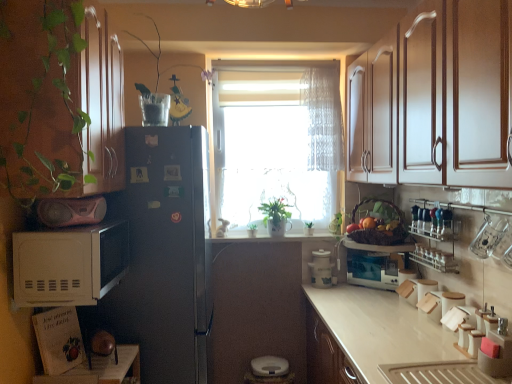
Describe the element at coordinates (321, 269) in the screenshot. The image size is (512, 384). I see `white plastic container at center, positioned as the 1th appliance in back-to-front order` at that location.

Where is `white plastic container at center, the third appliance positioned from the bottom`? This screenshot has height=384, width=512. white plastic container at center, the third appliance positioned from the bottom is located at coordinates (321, 269).

The image size is (512, 384). What do you see at coordinates (323, 118) in the screenshot?
I see `translucent fabric curtain at center` at bounding box center [323, 118].

Describe the element at coordinates (497, 355) in the screenshot. I see `white plastic soap dispenser at lower right, marked as the 1th appliance in a front-to-back arrangement` at that location.

At what (x,y) coordinates should I click in order to perform the action: click on white plastic soap dispenser at lower right, marked as the 1th appliance in a front-to-back arrangement. Please return your answer as a coordinate pair (x, y). This screenshot has width=512, height=384. Looking at the image, I should click on (497, 355).

What is the approximate height of green matte plant at center?

green matte plant at center is 9.45 inches in height.

At what (x,y) coordinates should I click in order to perform the action: click on white plastic container at center, which is the 2th appliance from left to right. Please return your answer as a coordinate pair (x, y). The height and width of the screenshot is (384, 512). Looking at the image, I should click on (321, 269).

How much distance is there between white glossy cabinet at upper right, which ranks as the 2th cabinetry in left-to-right order, and green matte cabinet at left, which appears as the second cabinetry when viewed from the right?

1.26 meters.

From the picture: Between white glossy cabinet at upper right, which ranks as the 2th cabinetry in left-to-right order, and green matte cabinet at left, which appears as the second cabinetry when viewed from the right, which one is positioned behind?

green matte cabinet at left, which appears as the second cabinetry when viewed from the right.

Find the location of a particular element. The image size is (512, 384). cabinetry below the white glossy cabinet at upper right, positioned as the first cabinetry in right-to-left order (from the image's perspective) is located at coordinates (60, 101).

Considering the relative sizes of white glossy cabinet at upper right, positioned as the first cabinetry in right-to-left order, and green matte cabinet at left, acting as the 1th cabinetry starting from the left, in the image provided, is white glossy cabinet at upper right, positioned as the first cabinetry in right-to-left order, wider than green matte cabinet at left, acting as the 1th cabinetry starting from the left,?

Correct, the width of white glossy cabinet at upper right, positioned as the first cabinetry in right-to-left order, exceeds that of green matte cabinet at left, acting as the 1th cabinetry starting from the left.

Can you confirm if translucent fabric curtain at center is wider than green matte cabinet at left, which appears as the second cabinetry when viewed from the right?

No.

From a real-world perspective, between translucent fabric curtain at center and green matte cabinet at left, acting as the 1th cabinetry starting from the left, who is vertically higher?

translucent fabric curtain at center, from a real-world perspective.

Who is bigger, translucent fabric curtain at center or green matte cabinet at left, acting as the 1th cabinetry starting from the left?

Bigger between the two is green matte cabinet at left, acting as the 1th cabinetry starting from the left.

Can white plastic soap dispenser at lower right, acting as the fourth appliance starting from the left, be found inside green matte cabinet at left, acting as the 1th cabinetry starting from the left?

Actually, white plastic soap dispenser at lower right, acting as the fourth appliance starting from the left, is outside green matte cabinet at left, acting as the 1th cabinetry starting from the left.

From the image's perspective, which is above, green matte cabinet at left, which appears as the second cabinetry when viewed from the right, or white plastic soap dispenser at lower right, the first appliance when ordered from bottom to top?

green matte cabinet at left, which appears as the second cabinetry when viewed from the right, from the image's perspective.

Which is in front, point (112, 61) or point (498, 361)?

The point (498, 361) is closer.

Is green matte cabinet at left, which appears as the second cabinetry when viewed from the right, far away from white plastic soap dispenser at lower right, placed as the fourth appliance when sorted from back to front?

Yes, green matte cabinet at left, which appears as the second cabinetry when viewed from the right, is far from white plastic soap dispenser at lower right, placed as the fourth appliance when sorted from back to front.

Is point (267, 227) behind point (478, 361)?

Yes, it is.

Does green matte plant at center have a lesser height compared to white plastic soap dispenser at lower right, marked as the first appliance in a right-to-left arrangement?

No, green matte plant at center is not shorter than white plastic soap dispenser at lower right, marked as the first appliance in a right-to-left arrangement.

From the picture: From a real-world perspective, which is physically above, green matte plant at center or white plastic soap dispenser at lower right, placed as the fourth appliance when sorted from back to front?

green matte plant at center, from a real-world perspective.

From the image's perspective, between green matte plant at center and white plastic soap dispenser at lower right, marked as the first appliance in a right-to-left arrangement, which one is located above?

green matte plant at center appears higher in the image.

In the scene shown: How far apart are white plastic soap dispenser at lower right, the first appliance when ordered from bottom to top, and clear glass bottles at upper right?

white plastic soap dispenser at lower right, the first appliance when ordered from bottom to top, and clear glass bottles at upper right are 25.71 inches apart from each other.

Does white plastic soap dispenser at lower right, marked as the first appliance in a right-to-left arrangement, lie behind clear glass bottles at upper right?

No, the depth of white plastic soap dispenser at lower right, marked as the first appliance in a right-to-left arrangement, is less than that of clear glass bottles at upper right.

In the image, is white plastic soap dispenser at lower right, marked as the first appliance in a right-to-left arrangement, on the left side or the right side of clear glass bottles at upper right?

Clearly, white plastic soap dispenser at lower right, marked as the first appliance in a right-to-left arrangement, is on the left of clear glass bottles at upper right in the image.

Considering the points (487, 358) and (460, 226), which point is behind, point (487, 358) or point (460, 226)?

Point (460, 226)

From the image's perspective, would you say pink matte boombox at left, which is the third appliance from back to front, is shown under orange matte at right?

Actually, pink matte boombox at left, which is the third appliance from back to front, appears above orange matte at right in the image.

Does pink matte boombox at left, which ranks as the 4th appliance in right-to-left order, come behind orange matte at right?

No, it is in front of orange matte at right.

Between point (95, 206) and point (374, 220), which one is positioned in front?

Positioned in front is point (95, 206).

Would you consider pink matte boombox at left, which is the third appliance from back to front, to be distant from orange matte at right?

Yes, pink matte boombox at left, which is the third appliance from back to front, and orange matte at right are located far from each other.

Does white plastic soap dispenser at lower right, marked as the first appliance in a right-to-left arrangement, have a lesser height compared to white glossy cabinet at upper right, which ranks as the 2th cabinetry in left-to-right order?

Indeed, white plastic soap dispenser at lower right, marked as the first appliance in a right-to-left arrangement, has a lesser height compared to white glossy cabinet at upper right, which ranks as the 2th cabinetry in left-to-right order.

Is white plastic soap dispenser at lower right, placed as the fourth appliance when sorted from back to front, touching white glossy cabinet at upper right, which ranks as the 2th cabinetry in left-to-right order?

No, white plastic soap dispenser at lower right, placed as the fourth appliance when sorted from back to front, is not in contact with white glossy cabinet at upper right, which ranks as the 2th cabinetry in left-to-right order.

Considering the relative positions of white plastic soap dispenser at lower right, placed as the fourth appliance when sorted from back to front, and white glossy cabinet at upper right, positioned as the first cabinetry in right-to-left order, in the image provided, is white plastic soap dispenser at lower right, placed as the fourth appliance when sorted from back to front, to the right of white glossy cabinet at upper right, positioned as the first cabinetry in right-to-left order, from the viewer's perspective?

Indeed, white plastic soap dispenser at lower right, placed as the fourth appliance when sorted from back to front, is positioned on the right side of white glossy cabinet at upper right, positioned as the first cabinetry in right-to-left order.

You are a GUI agent. You are given a task and a screenshot of the screen. Output one action in this format:
    pyautogui.click(x=<x>, y=<y>)
    Task: Click on the cabinetry lying below the white glossy cabinet at upper right, positioned as the first cabinetry in right-to-left order (from the image's perspective)
    The image size is (512, 384).
    Given the screenshot: What is the action you would take?
    pyautogui.click(x=60, y=101)

The image size is (512, 384). What are the coordinates of `curtain above the green matte cabinet at left, which appears as the second cabinetry when viewed from the right (from the image's perspective)` in the screenshot? It's located at (323, 118).

Considering their positions, is translucent fabric curtain at center positioned further to white glossy countertop at lower right than green matte cabinet at left, acting as the 1th cabinetry starting from the left?

Based on the image, green matte cabinet at left, acting as the 1th cabinetry starting from the left, appears to be further to white glossy countertop at lower right.

Based on the photo, based on their spatial positions, is clear glass vase at upper center or white glossy countertop at lower right further from white plastic soap dispenser at lower right, the 4th appliance positioned from the top?

clear glass vase at upper center lies further to white plastic soap dispenser at lower right, the 4th appliance positioned from the top, than the other object.

When comparing their distances from orange matte at right, does translucent fabric curtain at center or pink matte boombox at left, acting as the 1th appliance starting from the left, seem closer?

translucent fabric curtain at center is closer to orange matte at right.

Based on their spatial positions, is orange matte at right or white matte microwave at left further from green matte plant at center?

white matte microwave at left is positioned further to the anchor green matte plant at center.

Estimate the real-world distances between objects in this image. Which object is closer to white glossy toaster oven at center, the 2th appliance in the back-to-front sequence, white matte microwave at left or green matte plant at center?

Based on the image, green matte plant at center appears to be nearer to white glossy toaster oven at center, the 2th appliance in the back-to-front sequence.

When comparing their distances from green matte plant at center, does white plastic container at center, positioned as the 1th appliance in back-to-front order, or white plastic soap dispenser at lower right, the first appliance when ordered from bottom to top, seem closer?

white plastic container at center, positioned as the 1th appliance in back-to-front order, is positioned closer to the anchor green matte plant at center.

Considering their positions, is white matte microwave at left positioned closer to white plastic container at center, the third appliance positioned from the bottom, than pink matte boombox at left, acting as the 1th appliance starting from the left?

Among the two, white matte microwave at left is located nearer to white plastic container at center, the third appliance positioned from the bottom.

Considering their positions, is brown woven basket at center positioned further to white glossy countertop at lower right than white plastic container at center, the third appliance positioned from the bottom?

white plastic container at center, the third appliance positioned from the bottom, is further to white glossy countertop at lower right.

Identify the location of plant between white matte microwave at left and orange matte at right in the horizontal direction. (160, 56).

You are a GUI agent. You are given a task and a screenshot of the screen. Output one action in this format:
    pyautogui.click(x=<x>, y=<y>)
    Task: Click on the refrigerator situated between white matte microwave at left and orange matte at right from left to right
    
    Given the screenshot: What is the action you would take?
    pyautogui.click(x=167, y=253)

What are the coordinates of `fruit located between white plastic soap dispenser at lower right, marked as the first appliance in a right-to-left arrangement, and white plastic container at center, acting as the fourth appliance starting from the front, in the depth direction` in the screenshot? It's located at (368, 223).

The image size is (512, 384). In order to click on houseplant between green matte cabinet at left, which appears as the second cabinetry when viewed from the right, and white glossy toaster oven at center, acting as the third appliance starting from the front, from left to right in this screenshot , I will do `click(275, 216)`.